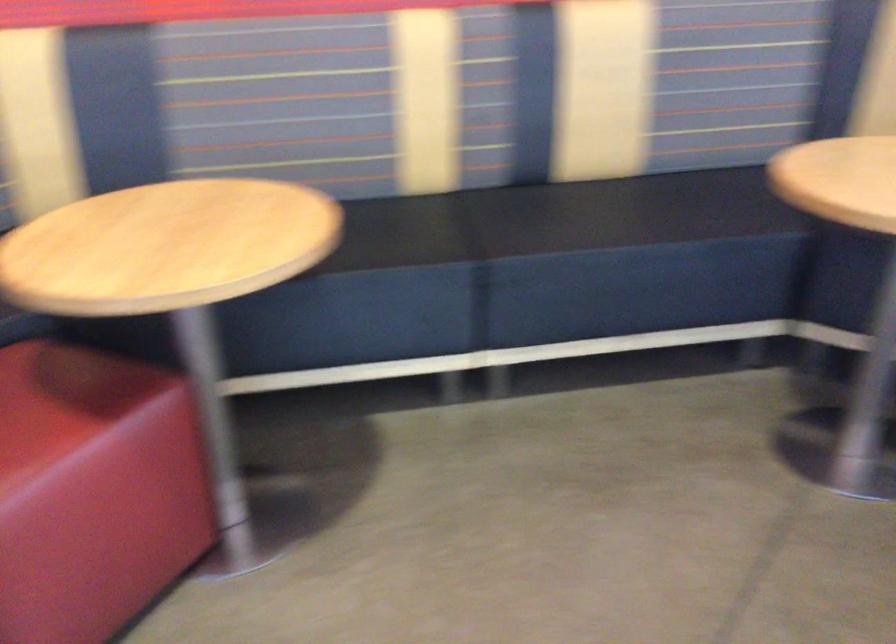
The images are taken continuously from a first-person perspective. In which direction is your viewpoint rotating?

The camera rotated toward right-down.